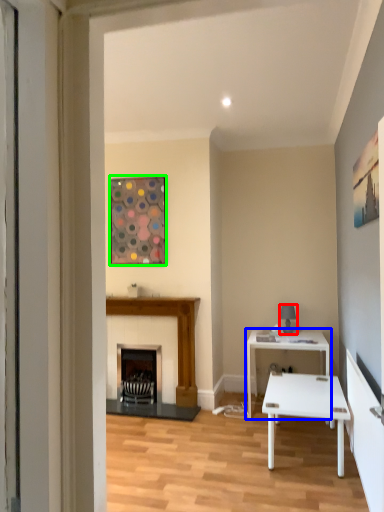
Question: Considering the real-world distances, which object is closest to lamp (highlighted by a red box)? table (highlighted by a blue box) or picture frame (highlighted by a green box).

Choices:
 (A) table
 (B) picture frame

Answer: (A)